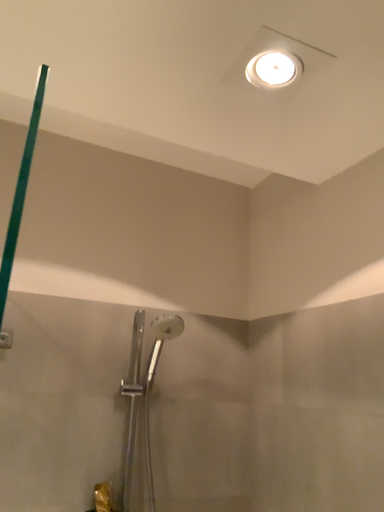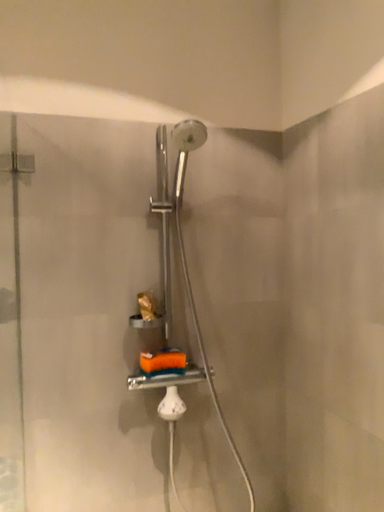
Question: How did the camera likely rotate when shooting the video?

Choices:
 (A) rotated downward
 (B) rotated upward

Answer: (A)